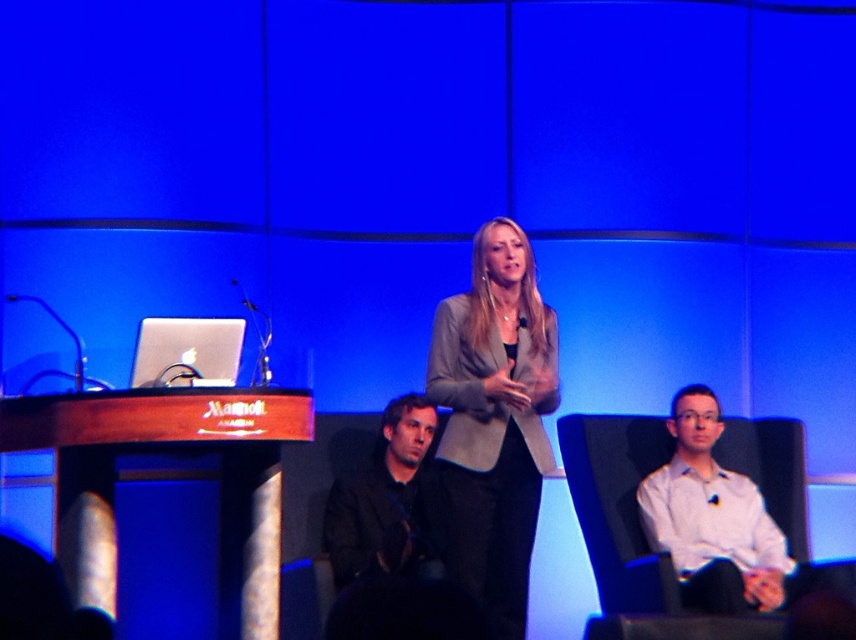
Can you confirm if white shirt at right is positioned to the left of black matte jacket at center?

In fact, white shirt at right is to the right of black matte jacket at center.

Consider the image. Can you confirm if white shirt at right is positioned above black matte jacket at center?

No, white shirt at right is not above black matte jacket at center.

The height and width of the screenshot is (640, 856). What do you see at coordinates (711, 516) in the screenshot? I see `white shirt at right` at bounding box center [711, 516].

Identify the location of white shirt at right. (711, 516).

Which is more to the left, matte gray blazer at center or black matte jacket at center?

black matte jacket at center

Is matte gray blazer at center bigger than black matte jacket at center?

Correct, matte gray blazer at center is larger in size than black matte jacket at center.

Locate an element on the screen. The image size is (856, 640). matte gray blazer at center is located at coordinates coord(494,420).

This screenshot has width=856, height=640. I want to click on matte gray blazer at center, so click(494, 420).

Where is `matte gray blazer at center`? matte gray blazer at center is located at coordinates (494, 420).

Is the position of matte gray blazer at center less distant than that of white shirt at right?

No, it is not.

Where is `matte gray blazer at center`? This screenshot has height=640, width=856. matte gray blazer at center is located at coordinates (494, 420).